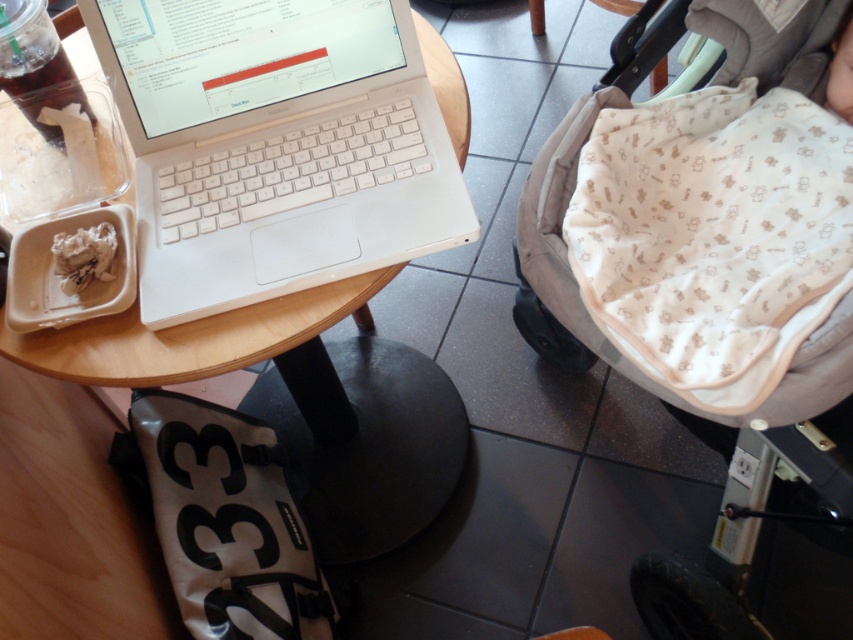
In the scene shown: You are sitting at a table in a public space and need to reach for your phone which is on the table. The white plastic laptop at center and beige fabric baby carriage at center are on the table. Which object is closer to your right hand if you are sitting at the table?

The beige fabric baby carriage at center is closer to your right hand because the white plastic laptop at center is to the left of it.

You are standing in a casual indoor setting, possibly a cafe, and see a round wooden table with a white MacBook laptop, a clear plastic cup with a green straw, and a small rectangular container with crumpled napkins. There is also a black and white bag partially visible under the table. If you want to place a new object exactly at the point with coordinates point (231, 168), how far in inches would that be from your current position?

The point (231, 168) is 35.07 inches away from the camera, so placing the new object there would require it to be 35.07 inches away from your current position.

You are sitting at the round wooden table with the laptop. You want to place a small item on the table such that it is closer to the camera than the laptop. Which of the two points, point (727, 29) or point (111, 273), should you choose?

You should choose point (727, 29) because it is further to the camera than point (111, 273), meaning it is closer to the camera compared to the laptop.